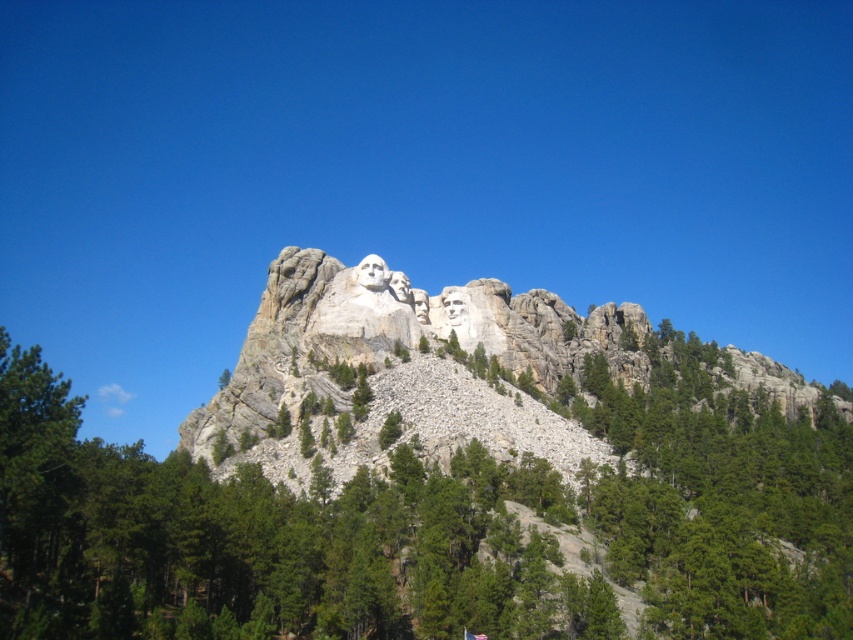
Image resolution: width=853 pixels, height=640 pixels. What do you see at coordinates (265, 540) in the screenshot? I see `green leafy tree at center` at bounding box center [265, 540].

Is green leafy tree at center thinner than white stone mountain at center?

Yes.

Which is in front, point (221, 609) or point (294, 353)?

Positioned in front is point (221, 609).

This screenshot has width=853, height=640. Find the location of `green leafy tree at center`. green leafy tree at center is located at coordinates tap(265, 540).